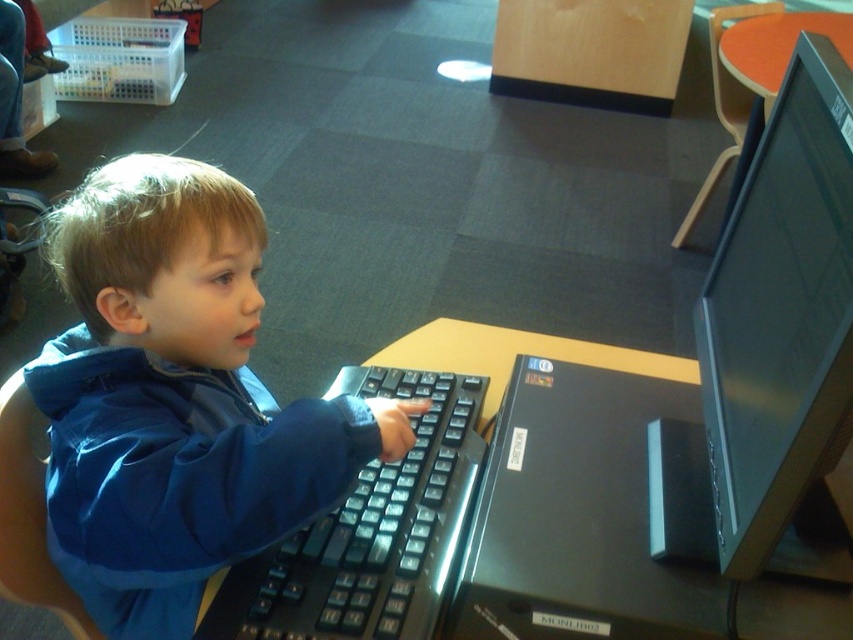
Which is behind, point (270, 611) or point (405, 356)?

The point (405, 356) is more distant.

Between black plastic keyboard at center and brown wooden table at center, which one appears on the left side from the viewer's perspective?

black plastic keyboard at center is more to the left.

This screenshot has width=853, height=640. I want to click on black plastic keyboard at center, so click(368, 532).

At what (x,y) coordinates should I click in order to perform the action: click on blue matte jacket at center. Please return your answer as a coordinate pair (x, y). The height and width of the screenshot is (640, 853). Looking at the image, I should click on (177, 400).

You are a GUI agent. You are given a task and a screenshot of the screen. Output one action in this format:
    pyautogui.click(x=<x>, y=<y>)
    Task: Click on the blue matte jacket at center
    The image size is (853, 640).
    Given the screenshot: What is the action you would take?
    pyautogui.click(x=177, y=400)

At what (x,y) coordinates should I click in order to perform the action: click on blue matte jacket at center. Please return your answer as a coordinate pair (x, y). The height and width of the screenshot is (640, 853). Looking at the image, I should click on (177, 400).

Is blue matte jacket at center thinner than black plastic keyboard at center?

Incorrect, blue matte jacket at center's width is not less than black plastic keyboard at center's.

Which is behind, point (108, 380) or point (323, 582)?

The point (323, 582) is more distant.

Who is more distant from viewer, (x=286, y=529) or (x=459, y=440)?

The point (x=459, y=440) is more distant.

Where is `blue matte jacket at center`? This screenshot has height=640, width=853. blue matte jacket at center is located at coordinates (177, 400).